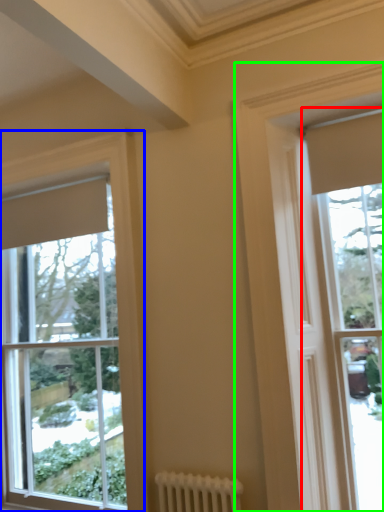
Question: Which object is positioned farthest from window (highlighted by a red box)? Select from window (highlighted by a blue box) and window (highlighted by a green box).

Choices:
 (A) window
 (B) window

Answer: (A)